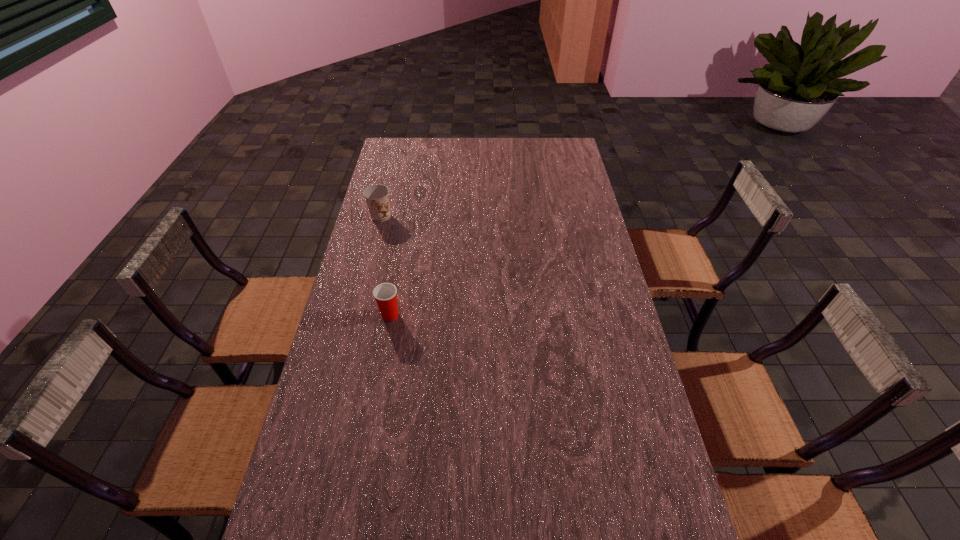
Where is `the tallest detergent`? The height and width of the screenshot is (540, 960). the tallest detergent is located at coordinates (467, 160).

The image size is (960, 540). Identify the location of the second blue detergent from right to left. (467, 160).

This screenshot has height=540, width=960. Find the location of `the left white detergent`. the left white detergent is located at coordinates (500, 206).

The image size is (960, 540). In order to click on the leftmost blue detergent in this screenshot , I will do `click(413, 251)`.

Locate an element on the screen. The image size is (960, 540). the second nearest blue detergent is located at coordinates (413, 251).

In order to click on the right white detergent in this screenshot , I will do `click(570, 243)`.

Identify the location of the smallest blue detergent. The image size is (960, 540). (611, 341).

Find the location of a particular element. the nearest blue detergent is located at coordinates (611, 341).

Locate an element on the screen. This screenshot has width=960, height=540. radio receiver is located at coordinates (504, 353).

Find the location of a particular element. This screenshot has width=960, height=540. dumbbell is located at coordinates (630, 481).